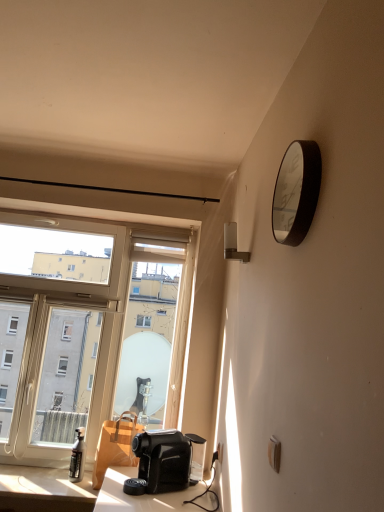
Describe the element at coordinates (78, 457) in the screenshot. Image resolution: width=384 pixels, height=512 pixels. I see `matte black spray bottle at lower left` at that location.

Locate an element on the screen. The width and height of the screenshot is (384, 512). matte black table at lower left is located at coordinates (43, 490).

What do you see at coordinates (233, 244) in the screenshot? I see `white plastic lamp at upper right` at bounding box center [233, 244].

Where is `transparent glass window at left`? transparent glass window at left is located at coordinates (83, 334).

Which is correct: metallic silver clock at upper right is inside white plastic lamp at upper right, or outside of it?

metallic silver clock at upper right is outside white plastic lamp at upper right.

Is point (272, 209) more distant than point (250, 256)?

No, (272, 209) is closer to viewer.

From the image's perspective, is metallic silver clock at upper right located above or below white plastic lamp at upper right?

metallic silver clock at upper right is situated higher than white plastic lamp at upper right in the image.

Relative to white plastic lamp at upper right, is metallic silver clock at upper right in front or behind?

Clearly, metallic silver clock at upper right is in front of white plastic lamp at upper right.

Does matte black table at lower left have a lesser width compared to white plastic electric outlet at lower right?

In fact, matte black table at lower left might be wider than white plastic electric outlet at lower right.

From a real-world perspective, which is physically above, matte black table at lower left or white plastic electric outlet at lower right?

In real-world perspective, white plastic electric outlet at lower right is above.

Is matte black table at lower left oriented towards white plastic electric outlet at lower right?

No, matte black table at lower left is not oriented towards white plastic electric outlet at lower right.

Considering the sizes of objects transparent glass window at left and white plastic electric outlet at lower right in the image provided, who is shorter, transparent glass window at left or white plastic electric outlet at lower right?

Standing shorter between the two is white plastic electric outlet at lower right.

Looking at this image, considering the sizes of transparent glass window at left and white plastic electric outlet at lower right in the image, is transparent glass window at left wider or thinner than white plastic electric outlet at lower right?

Considering their sizes, transparent glass window at left looks broader than white plastic electric outlet at lower right.

Identify the location of window above the white plastic electric outlet at lower right (from a real-world perspective). Image resolution: width=384 pixels, height=512 pixels. (83, 334).

Can you tell me how much transparent glass window at left and white plastic lamp at upper right differ in facing direction?

91.2 degrees separate the facing orientations of transparent glass window at left and white plastic lamp at upper right.

From the image's perspective, who appears lower, transparent glass window at left or white plastic lamp at upper right?

transparent glass window at left.

From a real-world perspective, does transparent glass window at left sit lower than white plastic lamp at upper right?

Yes, from a real-world perspective, transparent glass window at left is under white plastic lamp at upper right.

Based on their sizes in the image, would you say transparent glass window at left is bigger or smaller than white plastic lamp at upper right?

transparent glass window at left is bigger than white plastic lamp at upper right.

What's the angular difference between matte black table at lower left and transparent glass window at left's facing directions?

There is a 0.771-degree angle between the facing directions of matte black table at lower left and transparent glass window at left.

Is matte black table at lower left bigger or smaller than transparent glass window at left?

In the image, matte black table at lower left appears to be smaller than transparent glass window at left.

From a real-world perspective, is matte black table at lower left located beneath transparent glass window at left?

Indeed, from a real-world perspective, matte black table at lower left is positioned beneath transparent glass window at left.

From the image's perspective, is matte black table at lower left beneath transparent glass window at left?

Yes, from the image's perspective, matte black table at lower left is below transparent glass window at left.

Can we say metallic silver clock at upper right lies outside matte black spray bottle at lower left?

metallic silver clock at upper right is positioned outside matte black spray bottle at lower left.

From the image's perspective, is metallic silver clock at upper right above or below matte black spray bottle at lower left?

From the image's perspective, metallic silver clock at upper right appears above matte black spray bottle at lower left.

Based on the photo, is metallic silver clock at upper right at the left side of matte black spray bottle at lower left?

In fact, metallic silver clock at upper right is to the right of matte black spray bottle at lower left.

Image resolution: width=384 pixels, height=512 pixels. I want to click on clock lying on the right of matte black spray bottle at lower left, so click(x=296, y=192).

From a real-world perspective, is white plastic electric outlet at lower right positioned above or below transparent glass window at left?

Clearly, from a real-world perspective, white plastic electric outlet at lower right is below transparent glass window at left.

Considering the sizes of objects white plastic electric outlet at lower right and transparent glass window at left in the image provided, who is taller, white plastic electric outlet at lower right or transparent glass window at left?

Standing taller between the two is transparent glass window at left.

Which object is positioned more to the right, white plastic electric outlet at lower right or transparent glass window at left?

From the viewer's perspective, white plastic electric outlet at lower right appears more on the right side.

You are a GUI agent. You are given a task and a screenshot of the screen. Output one action in this format:
    pyautogui.click(x=<x>, y=<y>)
    Task: Click on the lamp to the left of metallic silver clock at upper right
    
    Given the screenshot: What is the action you would take?
    pyautogui.click(x=233, y=244)

Identify the location of table directly beneath the white plastic electric outlet at lower right (from a real-world perspective). (43, 490).

Looking at the image, which one is located closer to white plastic electric outlet at lower right, metallic silver clock at upper right or matte black table at lower left?

matte black table at lower left lies closer to white plastic electric outlet at lower right than the other object.

When comparing their distances from white plastic electric outlet at lower right, does transparent glass window at left or white plastic lamp at upper right seem closer?

The object closer to white plastic electric outlet at lower right is white plastic lamp at upper right.

Looking at this image, when comparing their distances from matte black spray bottle at lower left, does metallic silver clock at upper right or matte black table at lower left seem closer?

matte black table at lower left.

Estimate the real-world distances between objects in this image. Which object is further from matte black table at lower left, transparent glass window at left or white plastic electric outlet at lower right?

white plastic electric outlet at lower right lies further to matte black table at lower left than the other object.

When comparing their distances from white plastic lamp at upper right, does transparent glass window at left or white plastic electric outlet at lower right seem closer?

white plastic electric outlet at lower right is positioned closer to the anchor white plastic lamp at upper right.

Estimate the real-world distances between objects in this image. Which object is further from transparent glass window at left, white plastic lamp at upper right or white plastic electric outlet at lower right?

Among the two, white plastic electric outlet at lower right is located further to transparent glass window at left.

Based on their spatial positions, is matte black spray bottle at lower left or white plastic lamp at upper right closer to transparent glass window at left?

matte black spray bottle at lower left.

Considering their positions, is transparent glass window at left positioned closer to metallic silver clock at upper right than matte black table at lower left?

Among the two, transparent glass window at left is located nearer to metallic silver clock at upper right.

This screenshot has height=512, width=384. What are the coordinates of `bottle located between transparent glass window at left and white plastic electric outlet at lower right in the left-right direction` in the screenshot? It's located at (78, 457).

Locate an element on the screen. The height and width of the screenshot is (512, 384). lamp between metallic silver clock at upper right and transparent glass window at left in the front-back direction is located at coordinates (233, 244).

You are a GUI agent. You are given a task and a screenshot of the screen. Output one action in this format:
    pyautogui.click(x=<x>, y=<y>)
    Task: Click on the electric outlet between metallic silver clock at upper right and transparent glass window at left in the front-back direction
    
    Given the screenshot: What is the action you would take?
    pyautogui.click(x=219, y=452)

At what (x,y) coordinates should I click in order to perform the action: click on bottle located between matte black table at lower left and white plastic electric outlet at lower right in the left-right direction. Please return your answer as a coordinate pair (x, y). Looking at the image, I should click on 78,457.